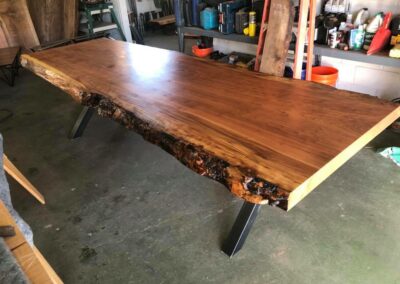
Where is `table legs`? table legs is located at coordinates (247, 213), (81, 116).